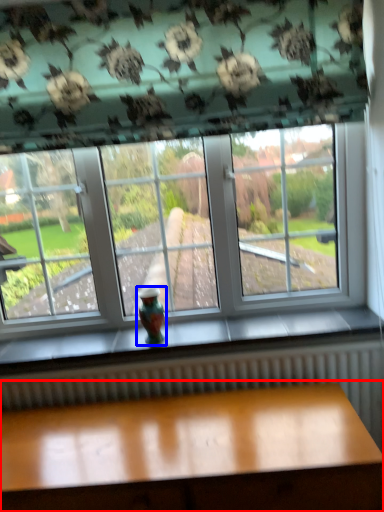
Question: Which of the following is the closest to the observer, table (highlighted by a red box) or glass vase (highlighted by a blue box)?

Choices:
 (A) table
 (B) glass vase

Answer: (A)